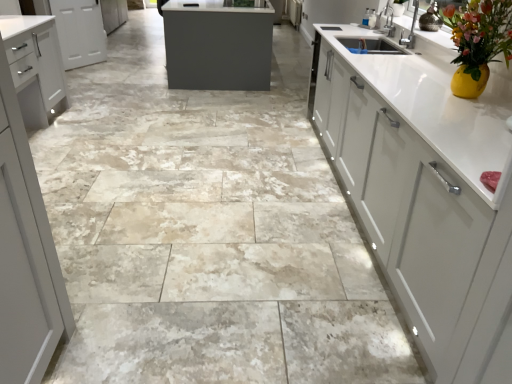
Question: From the image's perspective, does white matte cabinet at left, the first cabinetry viewed from the front, appear lower than white matte cabinet at upper left, the 2th cabinetry when ordered from front to back?

Choices:
 (A) no
 (B) yes

Answer: (B)

Question: Is white matte cabinet at left, the 2th cabinetry positioned from the back, touching white matte cabinet at upper left, which ranks as the 1th cabinetry in top-to-bottom order?

Choices:
 (A) no
 (B) yes

Answer: (A)

Question: Are white matte cabinet at left, arranged as the first cabinetry when ordered from the bottom, and white matte cabinet at upper left, the 2th cabinetry when ordered from front to back, far apart?

Choices:
 (A) yes
 (B) no

Answer: (A)

Question: From the image's perspective, is white matte cabinet at left, the 2th cabinetry positioned from the back, over white matte cabinet at upper left, which ranks as the 1th cabinetry in top-to-bottom order?

Choices:
 (A) yes
 (B) no

Answer: (B)

Question: From a real-world perspective, is white matte cabinet at left, which ranks as the second cabinetry in top-to-bottom order, over white matte cabinet at upper left, which ranks as the 1th cabinetry in top-to-bottom order?

Choices:
 (A) no
 (B) yes

Answer: (B)

Question: Is white matte cabinet at left, arranged as the first cabinetry when ordered from the bottom, at the left side of white matte cabinet at upper left, which appears as the second cabinetry when ordered from the bottom?

Choices:
 (A) yes
 (B) no

Answer: (B)

Question: From a real-world perspective, is white matte cabinet at upper left, which is the 1th cabinetry from back to front, physically above white matte cabinet at left, the 2th cabinetry positioned from the back?

Choices:
 (A) yes
 (B) no

Answer: (B)

Question: Is white matte cabinet at upper left, which ranks as the 1th cabinetry in top-to-bottom order, outside of white matte cabinet at left, the 2th cabinetry positioned from the back?

Choices:
 (A) no
 (B) yes

Answer: (B)

Question: Can you confirm if white matte cabinet at upper left, which is the 1th cabinetry from back to front, is bigger than white matte cabinet at left, which ranks as the second cabinetry in top-to-bottom order?

Choices:
 (A) no
 (B) yes

Answer: (A)

Question: Is white matte cabinet at upper left, the 2th cabinetry when ordered from front to back, at the left side of white matte cabinet at left, arranged as the first cabinetry when ordered from the bottom?

Choices:
 (A) no
 (B) yes

Answer: (B)

Question: Is white matte cabinet at left, which ranks as the second cabinetry in top-to-bottom order, inside white matte cabinet at upper left, which ranks as the 1th cabinetry in top-to-bottom order?

Choices:
 (A) no
 (B) yes

Answer: (A)

Question: Is white matte cabinet at upper left, the 2th cabinetry when ordered from front to back, turned away from white matte cabinet at left, arranged as the first cabinetry when ordered from the bottom?

Choices:
 (A) no
 (B) yes

Answer: (A)

Question: In the image, is white matte cabinet at upper left, which is the 1th cabinetry from back to front, positioned in front of or behind white matte cabinet at left, arranged as the first cabinetry when ordered from the bottom?

Choices:
 (A) behind
 (B) front

Answer: (A)